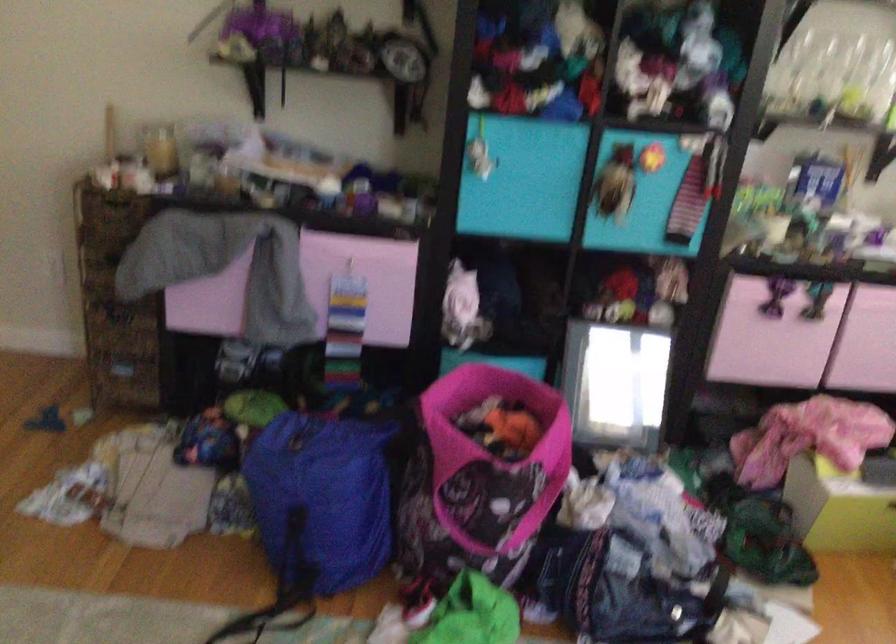
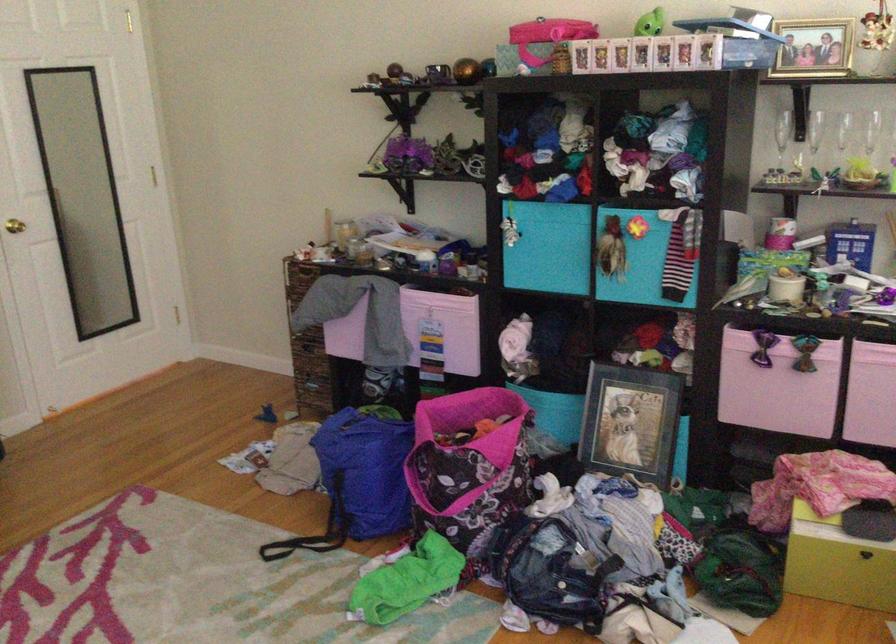
In the second image, find the point that corresponds to (x=773, y=303) in the first image.

(762, 353)